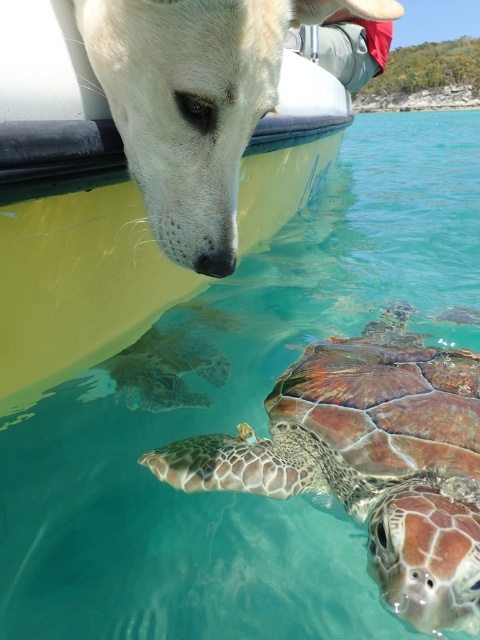
You are a marine biologist observing the scene. You need to determine the position of the brown textured shell at lower center relative to the white matte dog at upper left. Based on the image, which side of the dog is the turtle located?

The brown textured shell at lower center is to the right of the white matte dog at upper left, so the turtle is located to the right side of the dog.